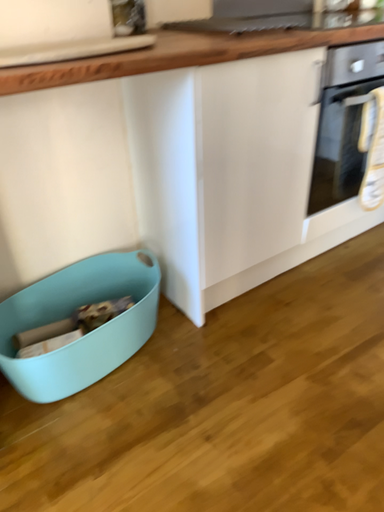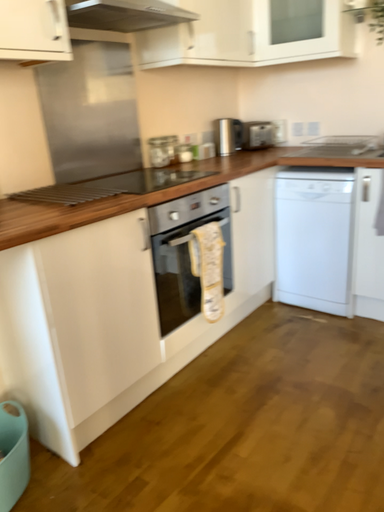
Question: Which way did the camera rotate in the video?

Choices:
 (A) rotated right
 (B) rotated left

Answer: (A)